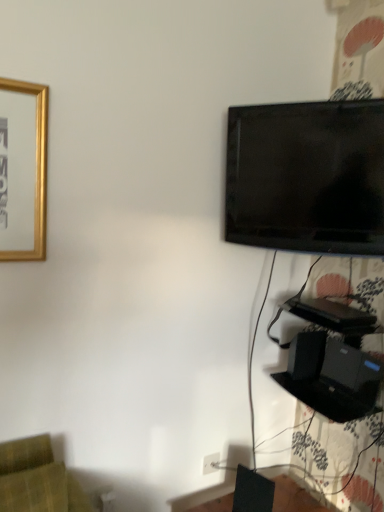
Question: Is white plastic electric outlet at lower center at the left side of black matte speaker at lower right, acting as the 2th speaker starting from the front?

Choices:
 (A) no
 (B) yes

Answer: (B)

Question: From the image's perspective, is white plastic electric outlet at lower center located above black matte speaker at lower right, placed as the 1th speaker when sorted from back to front?

Choices:
 (A) yes
 (B) no

Answer: (B)

Question: Is white plastic electric outlet at lower center positioned with its back to black matte speaker at lower right, the 1th speaker viewed from the right?

Choices:
 (A) no
 (B) yes

Answer: (A)

Question: Does white plastic electric outlet at lower center appear on the right side of black matte speaker at lower right, the 1th speaker viewed from the right?

Choices:
 (A) yes
 (B) no

Answer: (B)

Question: Is white plastic electric outlet at lower center taller than black matte speaker at lower right, placed as the 1th speaker when sorted from back to front?

Choices:
 (A) no
 (B) yes

Answer: (A)

Question: Are white plastic electric outlet at lower center and black matte speaker at lower right, which is the 2th speaker from bottom to top, far apart?

Choices:
 (A) yes
 (B) no

Answer: (B)

Question: From the image's perspective, is white plastic electric outlet at lower center located above black matte speaker at lower right, which ranks as the first speaker in front-to-back order?

Choices:
 (A) no
 (B) yes

Answer: (B)

Question: Can you confirm if white plastic electric outlet at lower center is positioned to the right of black matte speaker at lower right, placed as the second speaker when sorted from top to bottom?

Choices:
 (A) yes
 (B) no

Answer: (B)

Question: Considering the relative sizes of white plastic electric outlet at lower center and black matte speaker at lower right, which ranks as the first speaker in front-to-back order, in the image provided, is white plastic electric outlet at lower center thinner than black matte speaker at lower right, which ranks as the first speaker in front-to-back order,?

Choices:
 (A) no
 (B) yes

Answer: (B)

Question: From a real-world perspective, does white plastic electric outlet at lower center sit lower than black matte speaker at lower right, marked as the second speaker in a right-to-left arrangement?

Choices:
 (A) no
 (B) yes

Answer: (B)

Question: Is white plastic electric outlet at lower center taller than black matte speaker at lower right, which ranks as the first speaker in front-to-back order?

Choices:
 (A) yes
 (B) no

Answer: (B)

Question: Does white plastic electric outlet at lower center have a larger size compared to black matte speaker at lower right, marked as the second speaker in a right-to-left arrangement?

Choices:
 (A) yes
 (B) no

Answer: (B)

Question: From a real-world perspective, is black matte speaker at lower right, placed as the 1th speaker when sorted from back to front, physically below black matte speaker at lower right, marked as the second speaker in a right-to-left arrangement?

Choices:
 (A) yes
 (B) no

Answer: (B)